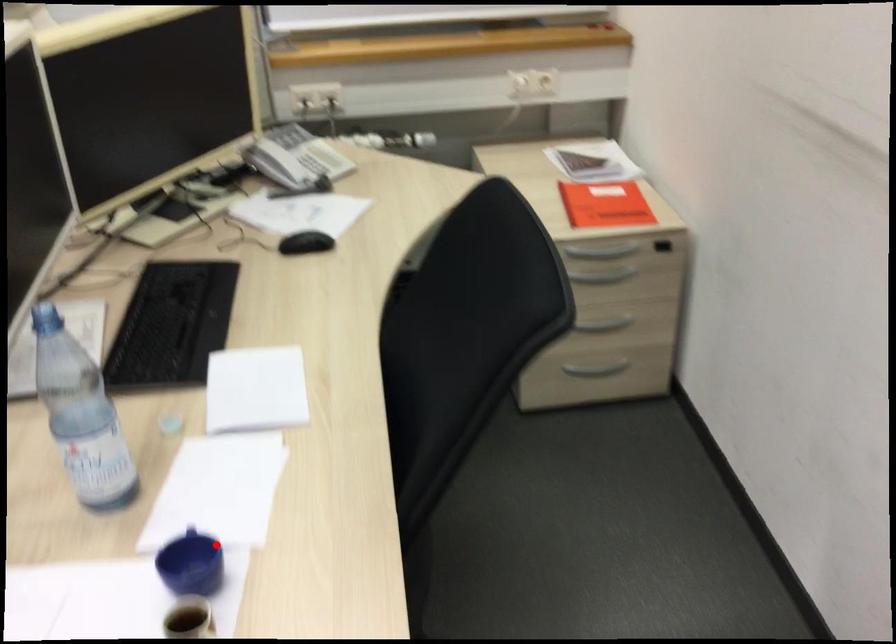
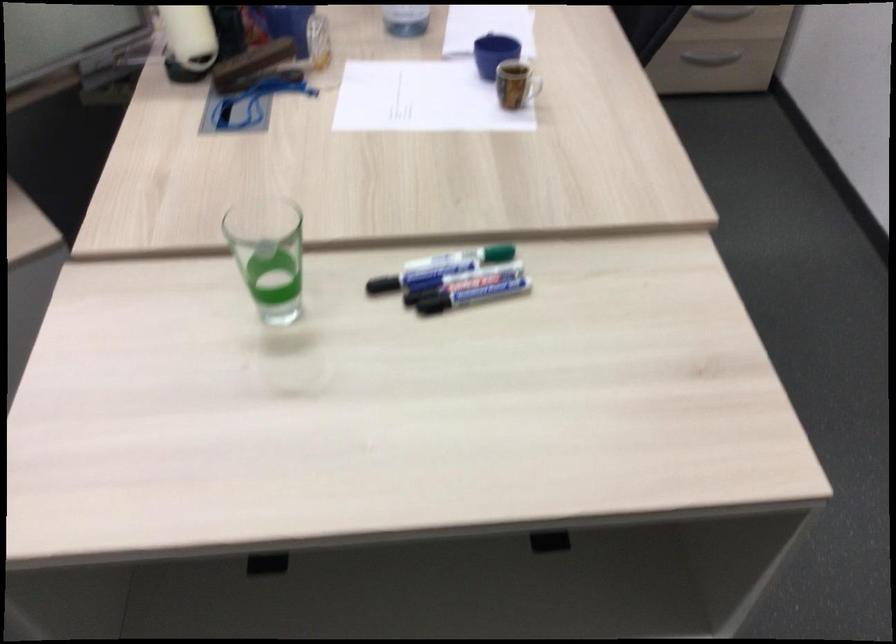
The point at the highlighted location is marked in the first image. Where is the corresponding point in the second image?

(494, 53)